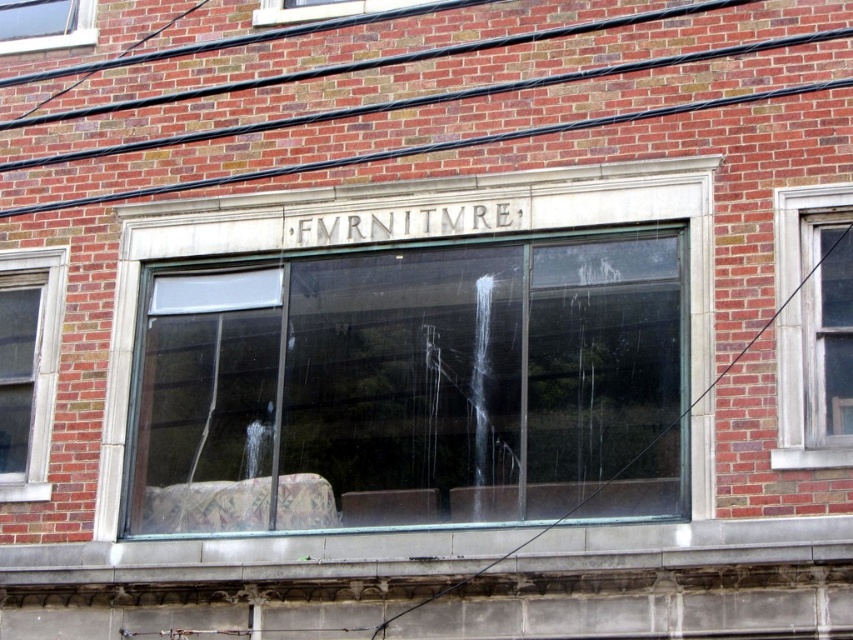
Question: Among these objects, which one is farthest from the camera?

Choices:
 (A) clear glass window at upper left
 (B) clear glass window at left
 (C) clear glass furniture at center
 (D) clear glass window at center

Answer: (A)

Question: Which point is farther to the camera?

Choices:
 (A) clear glass window at left
 (B) clear glass window at center
 (C) clear glass furniture at center
 (D) clear glass window at upper left

Answer: (D)

Question: Is clear glass window at center to the left of clear glass window at left from the viewer's perspective?

Choices:
 (A) yes
 (B) no

Answer: (B)

Question: Which point appears farthest from the camera in this image?

Choices:
 (A) (70, 19)
 (B) (42, 307)
 (C) (312, 211)

Answer: (A)

Question: From the image, what is the correct spatial relationship of clear glass window at left in relation to clear glass window at upper left?

Choices:
 (A) right
 (B) left

Answer: (A)

Question: Is clear glass window at center to the left of clear glass window at left from the viewer's perspective?

Choices:
 (A) yes
 (B) no

Answer: (B)